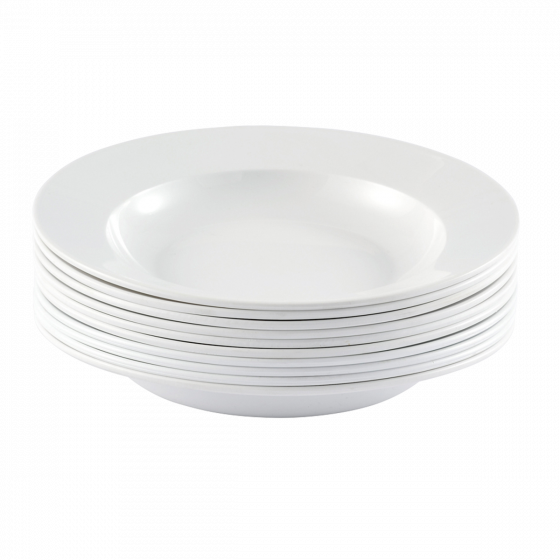
Find the location of `bowls`. bowls is located at coordinates (155, 380), (151, 370), (166, 364), (146, 351), (154, 343), (143, 331), (158, 324), (146, 312), (161, 306), (157, 293).